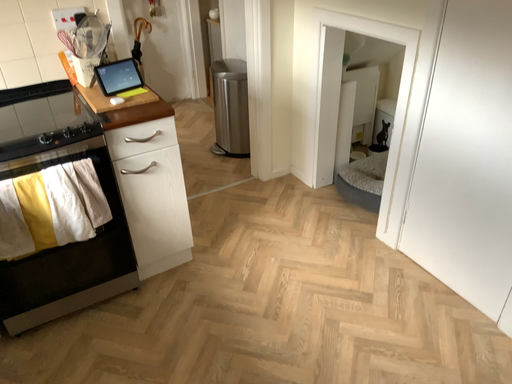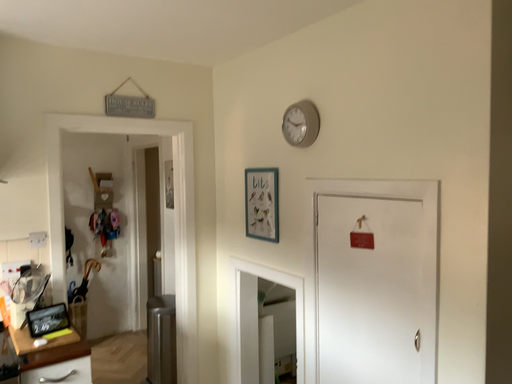
Question: Which way did the camera rotate in the video?

Choices:
 (A) rotated upward
 (B) rotated downward

Answer: (A)